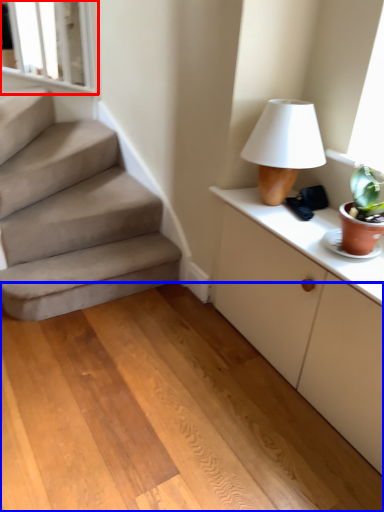
Question: Which object appears closest to the camera in this image, window frame (highlighted by a red box) or concrete (highlighted by a blue box)?

Choices:
 (A) window frame
 (B) concrete

Answer: (B)